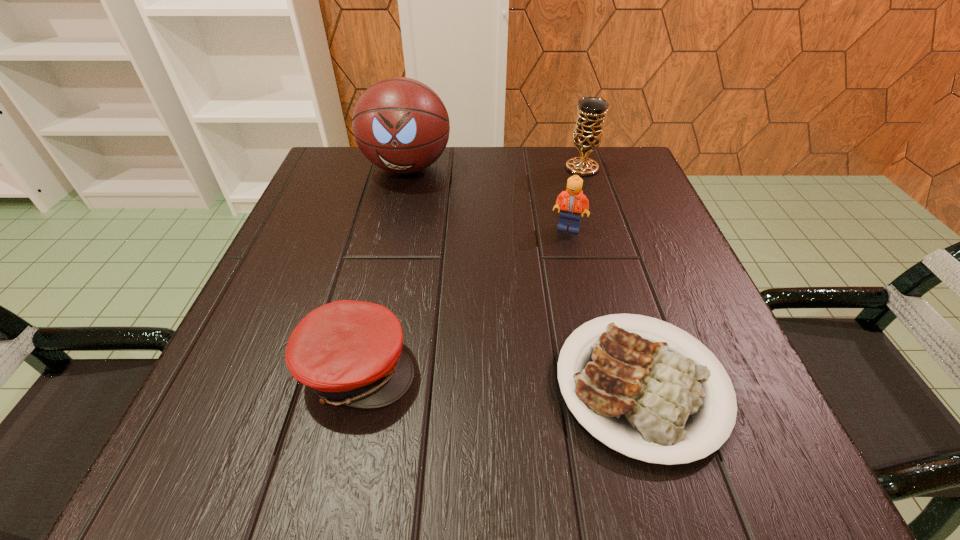
The width and height of the screenshot is (960, 540). What are the coordinates of `the tallest object` in the screenshot? It's located at (401, 125).

I want to click on chalice, so (588, 131).

Find the location of a particular element. This screenshot has height=540, width=960. Lego is located at coordinates coord(572,201).

The height and width of the screenshot is (540, 960). What are the coordinates of `the third tallest object` in the screenshot? It's located at (572, 201).

Locate an element on the screen. This screenshot has height=540, width=960. cap is located at coordinates (349, 352).

I want to click on plate, so click(x=652, y=400).

The image size is (960, 540). Identify the location of vacant region located on the right of the tallest object. (512, 167).

Locate an element on the screen. vacant area situated 0.180m on the front of the chalice is located at coordinates (600, 225).

The height and width of the screenshot is (540, 960). In order to click on vacant space positioned 0.120m on the front-facing side of the third farthest object in this screenshot , I will do `click(580, 277)`.

This screenshot has height=540, width=960. In order to click on vacant space located 0.200m on the front of the second shortest object with an emblem in this screenshot , I will do `click(555, 368)`.